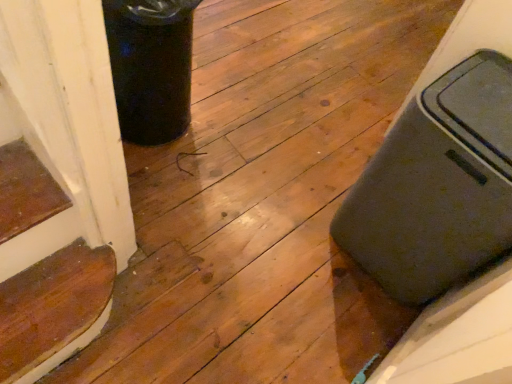
The width and height of the screenshot is (512, 384). What are the coordinates of `free spot to the left of matte gray suitcase at right` in the screenshot? It's located at (282, 195).